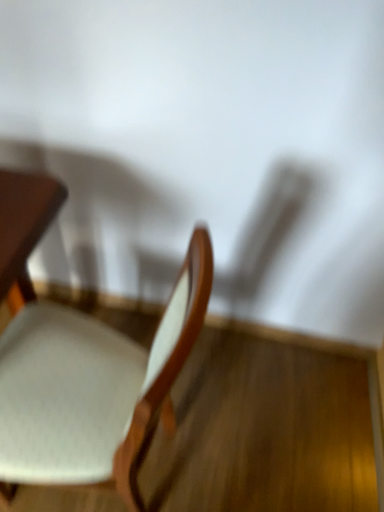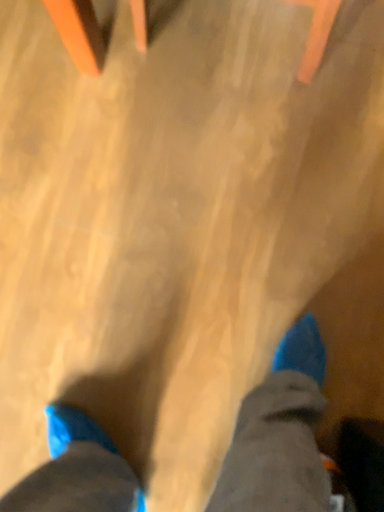
Question: Which way did the camera rotate in the video?

Choices:
 (A) rotated upward
 (B) rotated downward

Answer: (B)